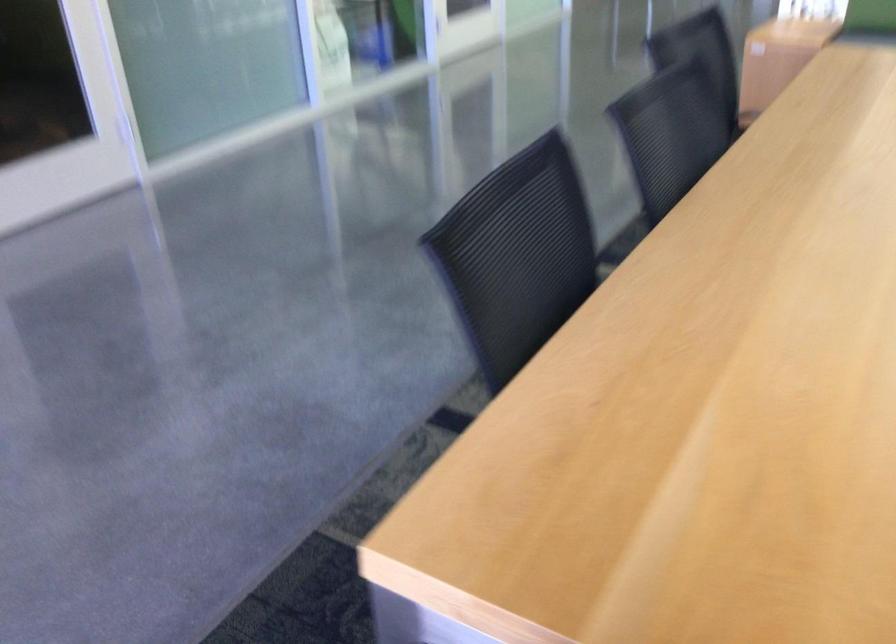
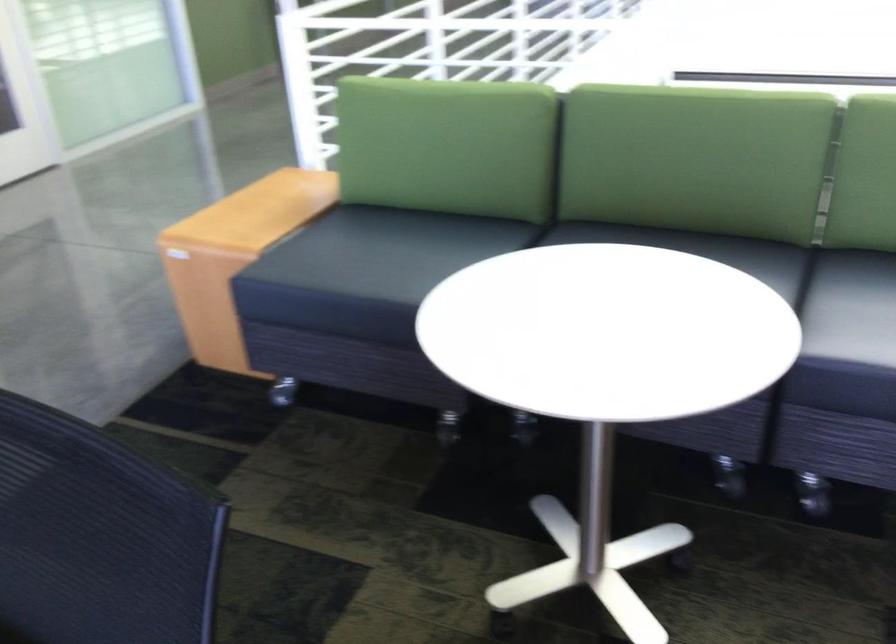
Question: I am providing you with two images of the same scene from different viewpoints. After the viewpoint changes to image2, which objects are now occluded?

Choices:
 (A) cardboard box
 (B) maroon chair armrest
 (C) black sofa sitting surface
 (D) wooden sofa armrest

Answer: (A)